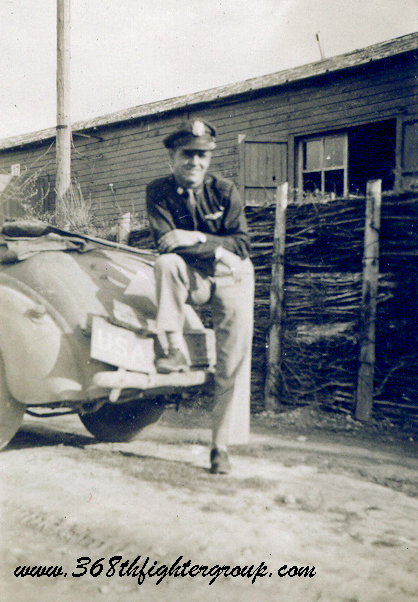
This screenshot has width=418, height=602. In order to click on window pane in this screenshot , I will do `click(309, 161)`, `click(337, 157)`.